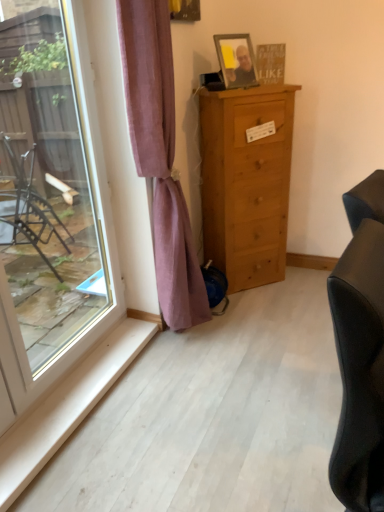
Question: From a real-world perspective, is light brown wood chest of drawers at center above or below purple velvet curtain at center?

Choices:
 (A) above
 (B) below

Answer: (B)

Question: Is light brown wood chest of drawers at center in front of or behind purple velvet curtain at center in the image?

Choices:
 (A) front
 (B) behind

Answer: (B)

Question: Estimate the real-world distances between objects in this image. Which object is farther from the purple velvet curtain at center?

Choices:
 (A) transparent glass window at left
 (B) black leather studio couch at right
 (C) wooden framed photo at upper center
 (D) light brown wood chest of drawers at center

Answer: (B)

Question: Which object is positioned closest to the transparent glass window at left?

Choices:
 (A) light brown wood chest of drawers at center
 (B) black leather studio couch at right
 (C) purple velvet curtain at center
 (D) wooden framed photo at upper center

Answer: (C)